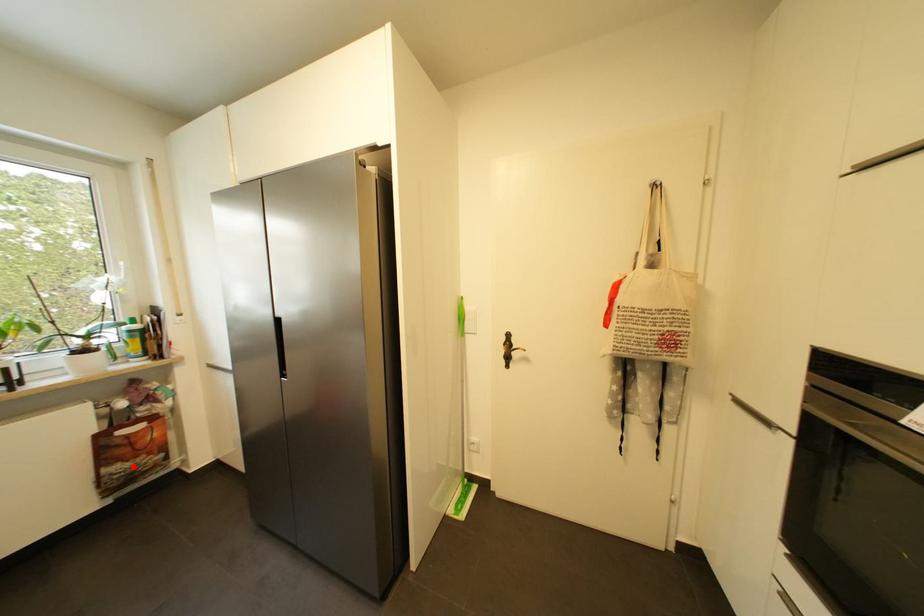
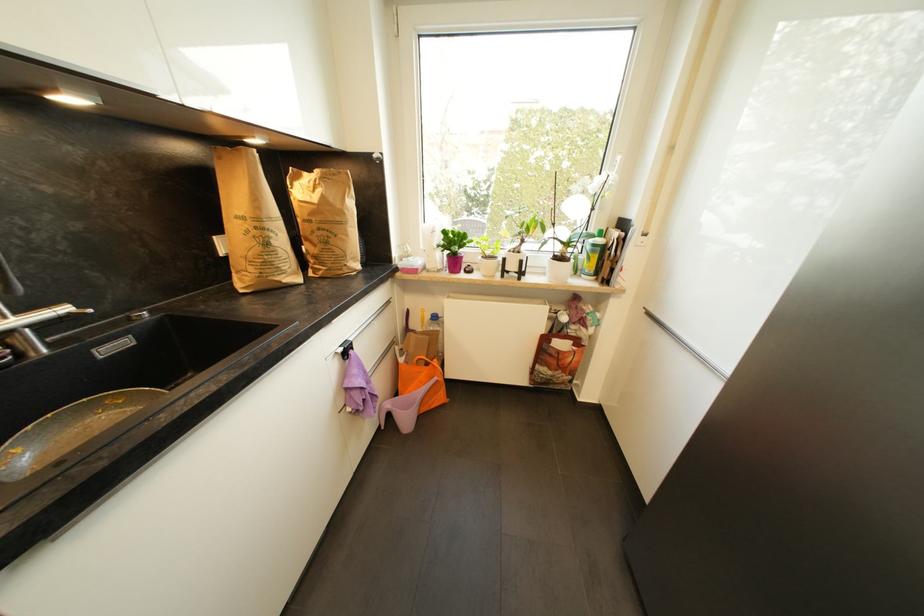
The point at the highlighted location is marked in the first image. Where is the corresponding point in the second image?

(554, 375)